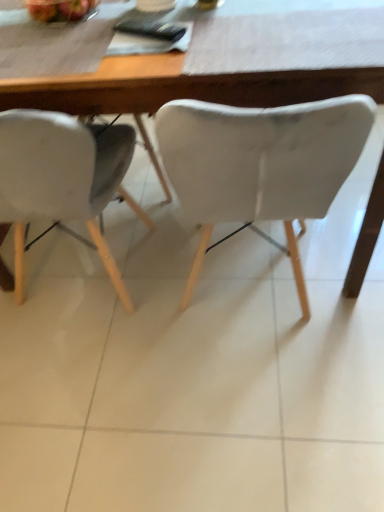
Question: Is white matte chair at left, marked as the 1th chair in a left-to-right arrangement, facing away from wooden table at center?

Choices:
 (A) yes
 (B) no

Answer: (A)

Question: Is white matte chair at left, arranged as the 2th chair when viewed from the right, thinner than wooden table at center?

Choices:
 (A) no
 (B) yes

Answer: (B)

Question: Is white matte chair at left, marked as the 1th chair in a left-to-right arrangement, next to wooden table at center and touching it?

Choices:
 (A) no
 (B) yes

Answer: (A)

Question: Is white matte chair at left, marked as the 1th chair in a left-to-right arrangement, taller than wooden table at center?

Choices:
 (A) no
 (B) yes

Answer: (B)

Question: Can you confirm if white matte chair at left, arranged as the 2th chair when viewed from the right, is smaller than wooden table at center?

Choices:
 (A) yes
 (B) no

Answer: (A)

Question: In the image, is wooden table at center positioned in front of or behind white matte chair at center, the second chair when ordered from left to right?

Choices:
 (A) front
 (B) behind

Answer: (B)

Question: Considering the positions of point (332, 86) and point (294, 208), is point (332, 86) closer or farther from the camera than point (294, 208)?

Choices:
 (A) farther
 (B) closer

Answer: (B)

Question: Looking at the image, does wooden table at center seem bigger or smaller compared to white matte chair at center, the second chair when ordered from left to right?

Choices:
 (A) big
 (B) small

Answer: (A)

Question: Considering the positions of wooden table at center and white matte chair at center, the second chair when ordered from left to right, in the image, is wooden table at center wider or thinner than white matte chair at center, the second chair when ordered from left to right,?

Choices:
 (A) wide
 (B) thin

Answer: (A)

Question: Is shiny red apple at upper left to the left or to the right of white matte chair at left, marked as the 1th chair in a left-to-right arrangement, in the image?

Choices:
 (A) right
 (B) left

Answer: (A)

Question: Is shiny red apple at upper left taller or shorter than white matte chair at left, arranged as the 2th chair when viewed from the right?

Choices:
 (A) tall
 (B) short

Answer: (B)

Question: Does point (44, 10) appear closer or farther from the camera than point (115, 133)?

Choices:
 (A) farther
 (B) closer

Answer: (B)

Question: From the image's perspective, relative to white matte chair at left, arranged as the 2th chair when viewed from the right, is shiny red apple at upper left above or below?

Choices:
 (A) above
 (B) below

Answer: (A)

Question: From a real-world perspective, is shiny red apple at upper left above or below white matte chair at center, the first chair viewed from the right?

Choices:
 (A) above
 (B) below

Answer: (A)

Question: Relative to white matte chair at center, the first chair viewed from the right, is shiny red apple at upper left in front or behind?

Choices:
 (A) behind
 (B) front

Answer: (A)